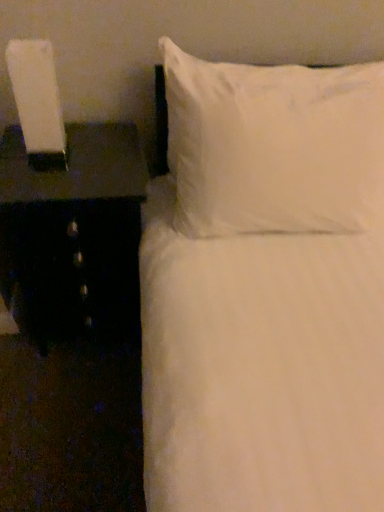
Question: Visually, is black glossy nightstand at left positioned to the left or to the right of white glossy lamp at left?

Choices:
 (A) right
 (B) left

Answer: (A)

Question: In terms of height, does black glossy nightstand at left look taller or shorter compared to white glossy lamp at left?

Choices:
 (A) tall
 (B) short

Answer: (A)

Question: Which is farther from the black glossy nightstand at left?

Choices:
 (A) white soft pillow at upper right
 (B) white glossy lamp at left

Answer: (A)

Question: Estimate the real-world distances between objects in this image. Which object is farther from the white soft pillow at upper right?

Choices:
 (A) white glossy lamp at left
 (B) black glossy nightstand at left

Answer: (A)